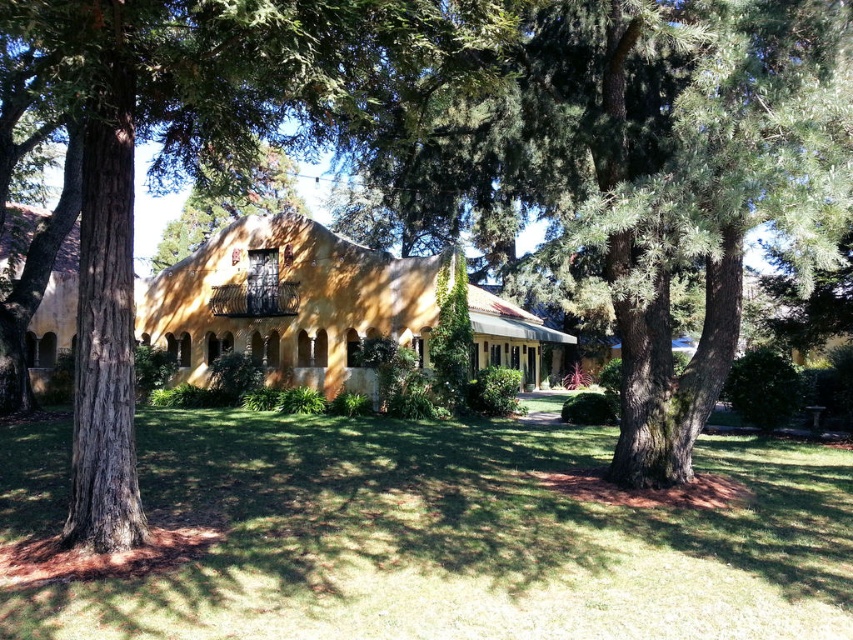
Question: Which of the following is the closest to the observer?

Choices:
 (A) brown textured tree at center
 (B) green grass at center

Answer: (B)

Question: Which point is closer to the camera?

Choices:
 (A) green grass at center
 (B) green textured tree at center
 (C) brown textured tree at center

Answer: (A)

Question: Is green grass at center wider than green textured tree at center?

Choices:
 (A) yes
 (B) no

Answer: (A)

Question: Is green textured tree at center thinner than brown textured tree at center?

Choices:
 (A) no
 (B) yes

Answer: (A)

Question: Which of the following is the farthest from the observer?

Choices:
 (A) brown textured tree at center
 (B) green grass at center

Answer: (A)

Question: Can you confirm if green grass at center is wider than brown textured tree at center?

Choices:
 (A) yes
 (B) no

Answer: (A)